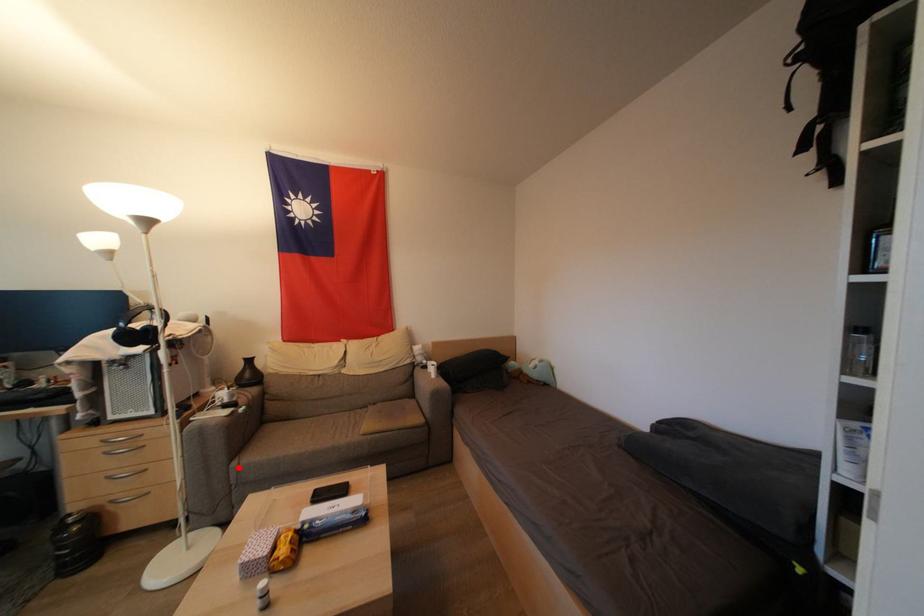
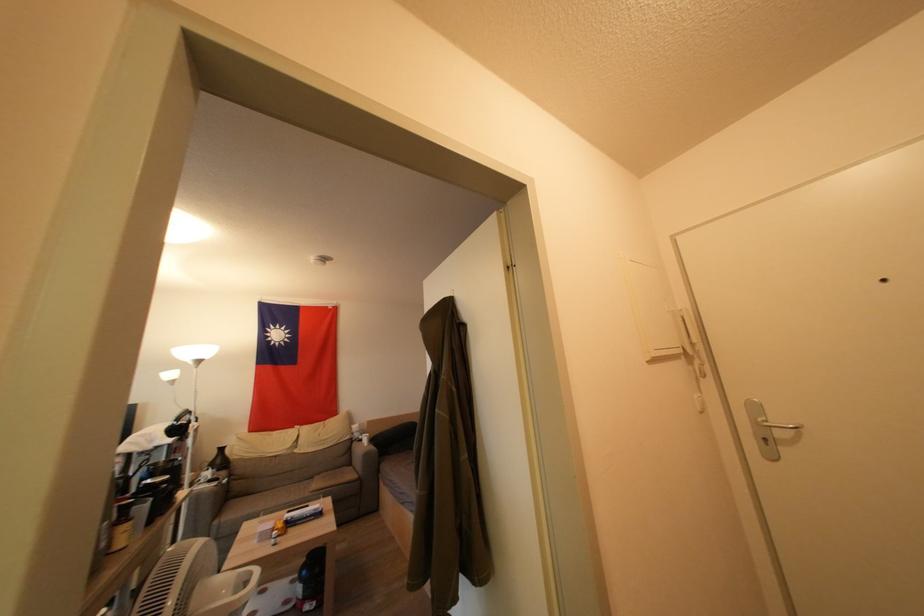
In the second image, find the point that corresponds to the highlighted location in the first image.

(221, 525)